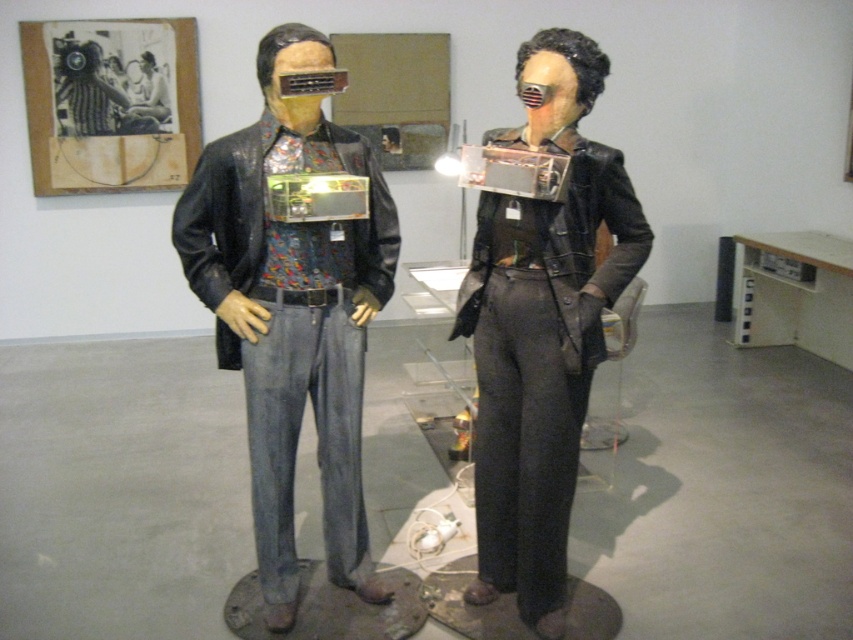
Consider the image. You are an art curator arranging an exhibition. You have two matte black leather jacket at center and shiny black leather jacket at center. Which one takes up more space in the display area?

The matte black leather jacket at center has a larger size compared to the shiny black leather jacket at center, so it takes up more space in the display area.

You are an art curator examining the two mannequins in the gallery. You notice both have a matte black leather jacket at center and a shiny black leather jacket at center. Which one is worn on top?

The matte black leather jacket at center is positioned over the shiny black leather jacket at center, so the matte black leather jacket at center is worn on top.

You are an artist planning to place a new sculpture between the two mannequins in the art gallery. The sculpture requires a space that is directly in front of the matte black leather jacket at center. Can you confirm if there is enough space between the two mannequins to place the sculpture there?

The matte black leather jacket at center is located at point (293, 312), which indicates its central position between the two mannequins. Since the sculpture needs to be placed directly in front of this jacket, there should be sufficient space between the two mannequins to accommodate it.